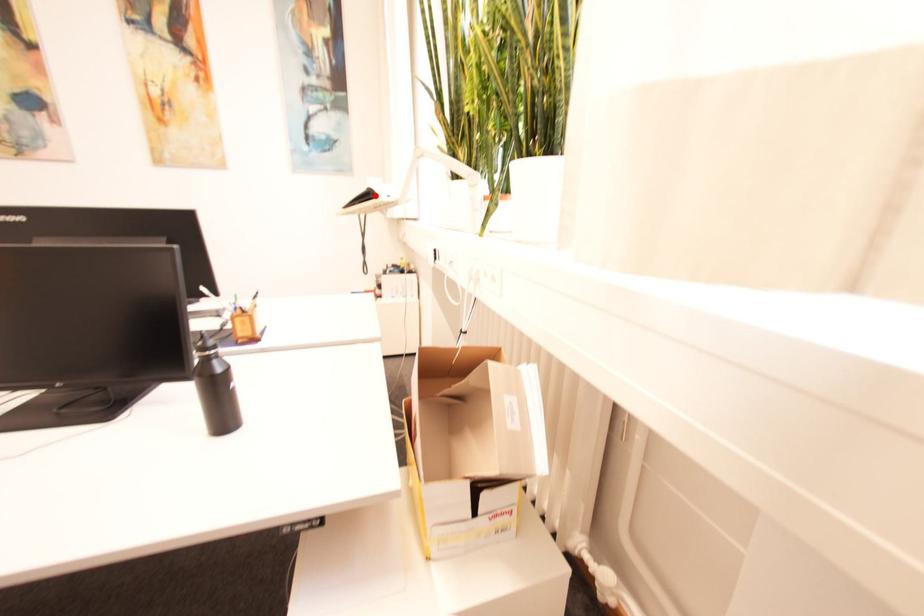
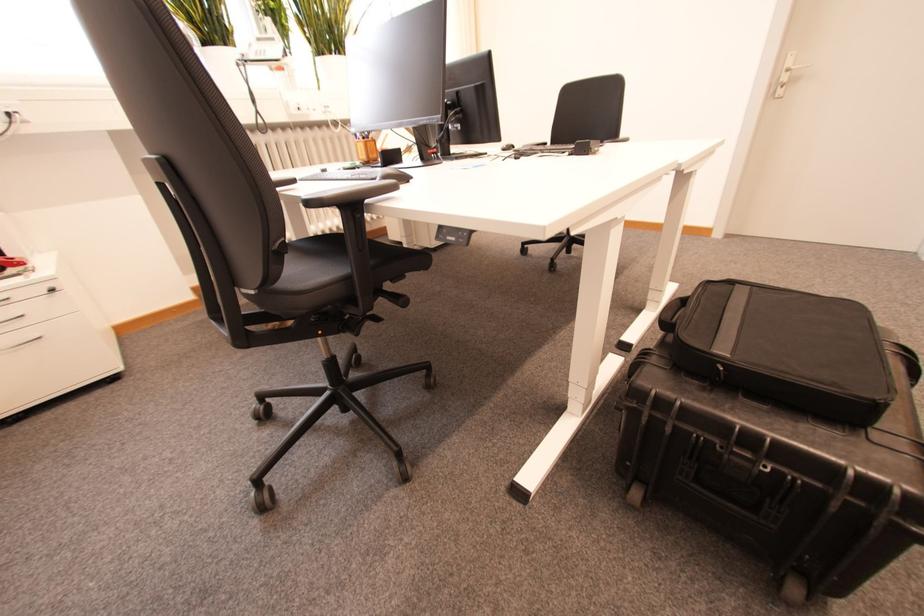
Question: I am providing you with two images of the same scene from different viewpoints. A red point is marked on the first image. Is the red point's position out of view in image 2?

Choices:
 (A) Yes
 (B) No

Answer: (A)